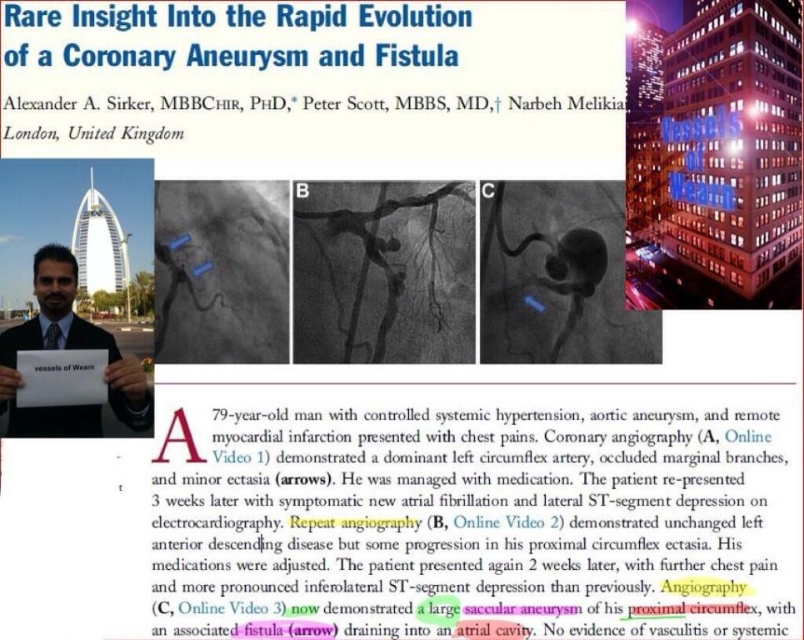
You are a researcher reviewing this medical slide. You notice the yellow highlighted text at center and the matte black suit at center. Which object takes up more vertical space on the slide?

The yellow highlighted text at center is much taller than the matte black suit at center, so it takes up more vertical space.

You are presenting this medical slide to an audience. You notice both the yellow highlighted text at center and the matte black suit at center. Which element is more prominent in terms of visual size?

The yellow highlighted text at center is more prominent in terms of visual size because it has a larger size compared to the matte black suit at center.